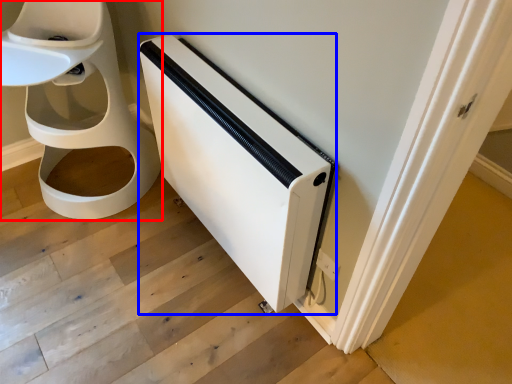
Question: Which object is closer to the camera taking this photo, toilet (highlighted by a red box) or appliance (highlighted by a blue box)?

Choices:
 (A) toilet
 (B) appliance

Answer: (B)